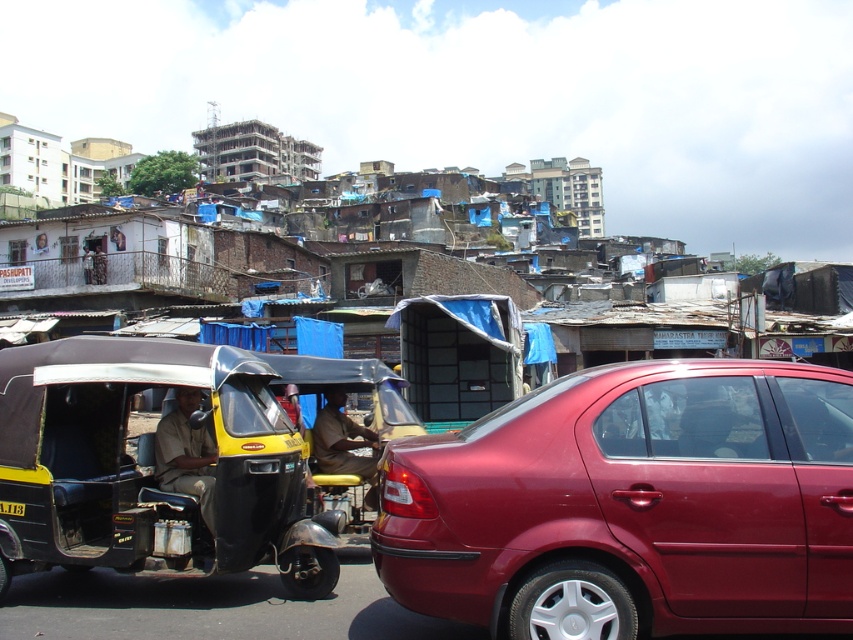
Locate an element on the screen. shiny metallic car at right is located at coordinates click(x=631, y=506).

Describe the element at coordinates (631, 506) in the screenshot. I see `shiny metallic car at right` at that location.

This screenshot has width=853, height=640. Describe the element at coordinates (631, 506) in the screenshot. I see `shiny metallic car at right` at that location.

You are a GUI agent. You are given a task and a screenshot of the screen. Output one action in this format:
    pyautogui.click(x=<x>, y=<y>)
    Task: Click on the shiny metallic car at right
    
    Given the screenshot: What is the action you would take?
    pyautogui.click(x=631, y=506)

The height and width of the screenshot is (640, 853). What do you see at coordinates (154, 467) in the screenshot?
I see `yellow matte tricycle at center` at bounding box center [154, 467].

Who is higher up, yellow matte tricycle at center or light brown fabric auto-rickshaw driver at center-left?

Positioned higher is light brown fabric auto-rickshaw driver at center-left.

Identify the location of yellow matte tricycle at center. This screenshot has height=640, width=853. (154, 467).

In order to click on yellow matte tricycle at center in this screenshot , I will do `click(154, 467)`.

Does light brown fabric auto-rickshaw driver at center-left have a lesser height compared to brown fabric auto-rickshaw driver at center?

Yes.

Is point (161, 442) in front of point (346, 461)?

Yes, point (161, 442) is in front of point (346, 461).

Identify the location of light brown fabric auto-rickshaw driver at center-left. (184, 452).